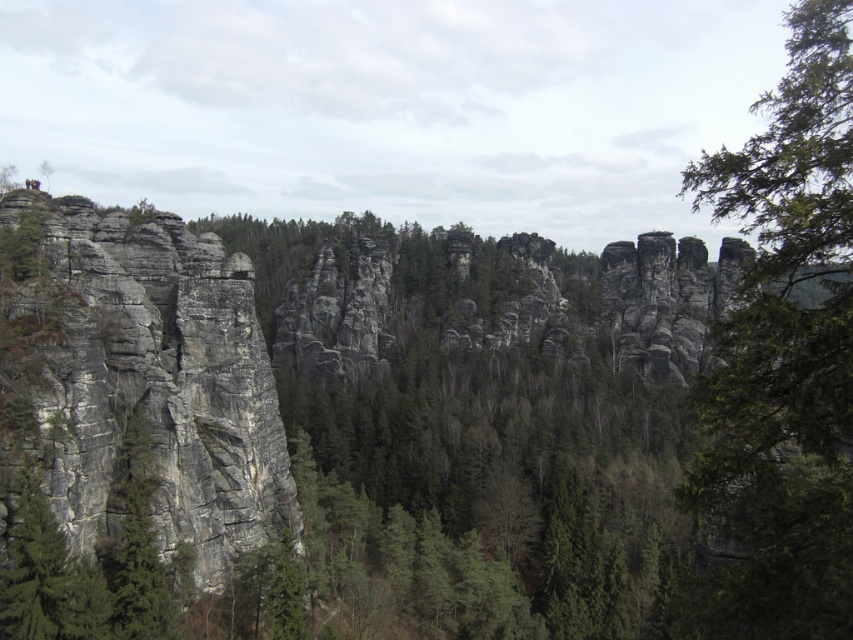
Question: Does green leafy tree at right appear under gray rough rock face at left?

Choices:
 (A) no
 (B) yes

Answer: (A)

Question: Is green leafy tree at right bigger than gray rough rock face at left?

Choices:
 (A) yes
 (B) no

Answer: (A)

Question: Which object is the farthest from the gray rough rock face at left?

Choices:
 (A) green matte tree at upper left
 (B) green leafy tree at right

Answer: (A)

Question: Which object appears farthest from the camera in this image?

Choices:
 (A) green matte tree at upper left
 (B) gray rough rock face at left

Answer: (A)

Question: Which point is closer to the camera?

Choices:
 (A) green leafy tree at right
 (B) green matte tree at upper left
 (C) gray rough rock face at left

Answer: (A)

Question: Does green leafy tree at right have a smaller size compared to green matte tree at upper left?

Choices:
 (A) yes
 (B) no

Answer: (B)